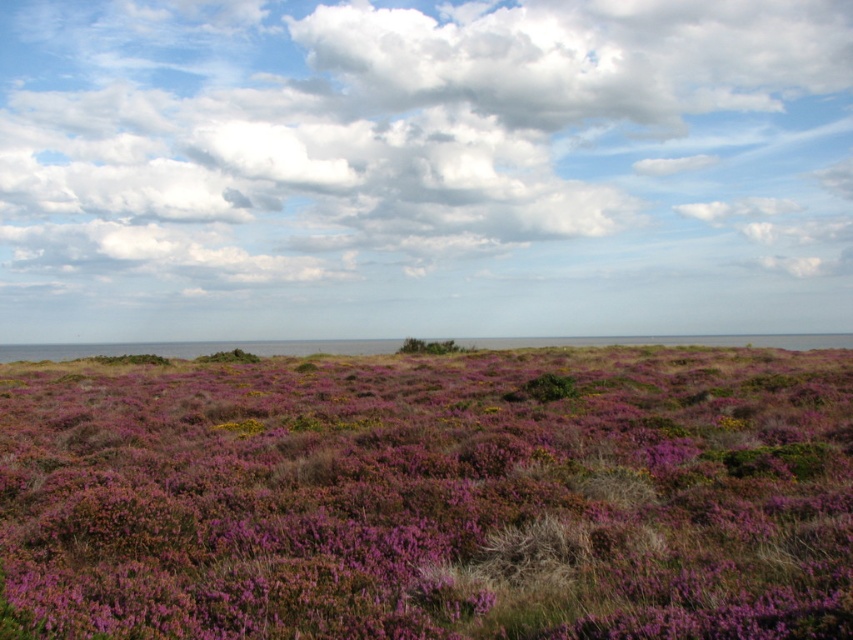
You are standing in the coastal landscape and want to take a photo of the cloudy sky at upper center and the purple grass at center. Which object will appear closer to the camera in the photo?

The cloudy sky at upper center will appear closer to the camera because the purple grass at center is positioned behind it.

You are standing at the point with coordinates point (x=380, y=586) and want to walk to the point with coordinates point (x=55, y=218). According to the scene, will you have to climb uphill or downhill?

Since point (x=55, y=218) is behind point (x=380, y=586), you will have to climb uphill to reach it.